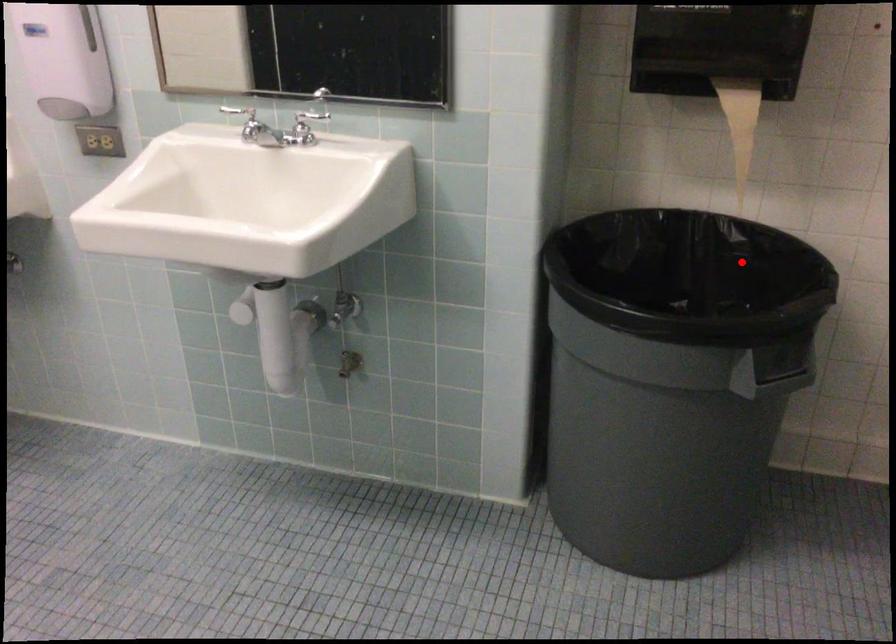
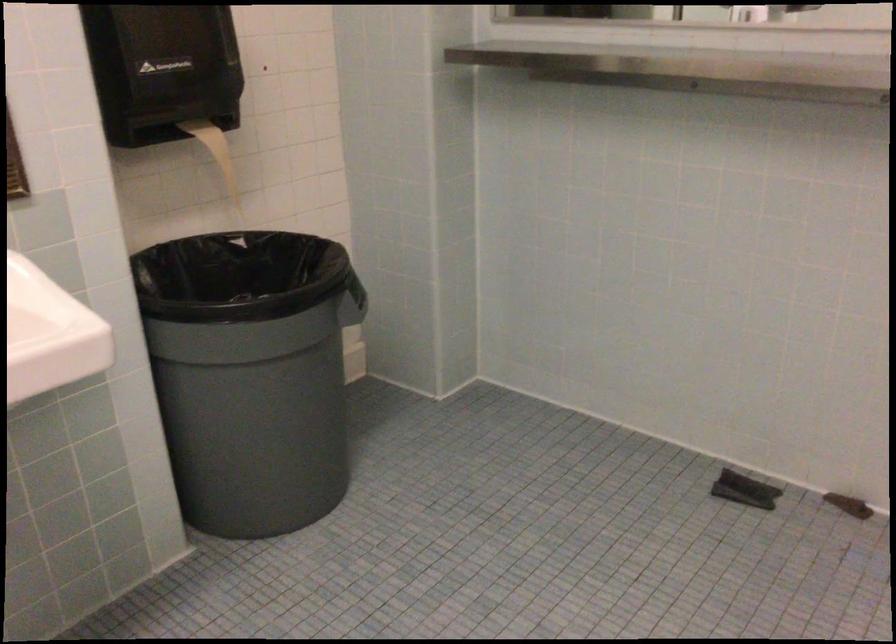
Locate, in the second image, the point that corresponds to the highlighted location in the first image.

(228, 266)